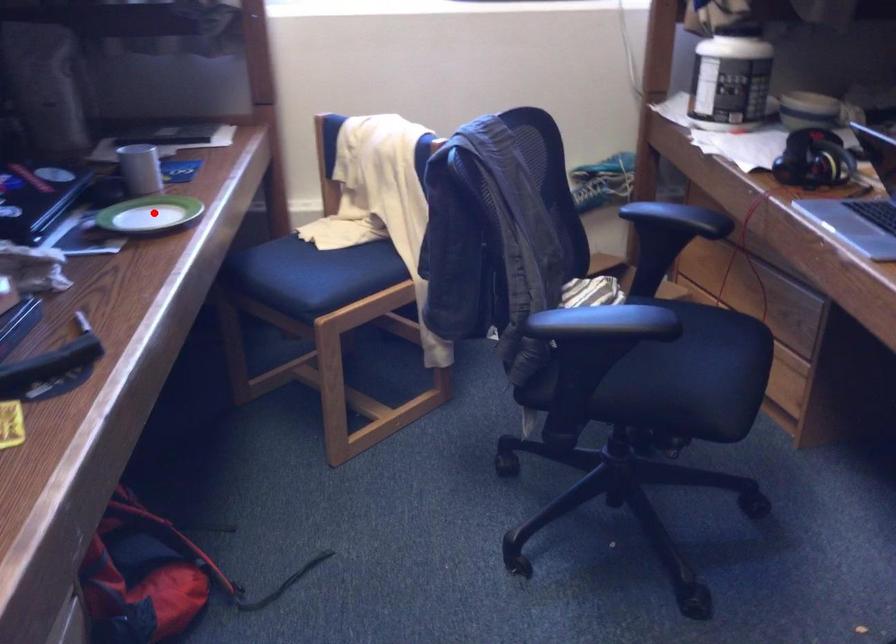
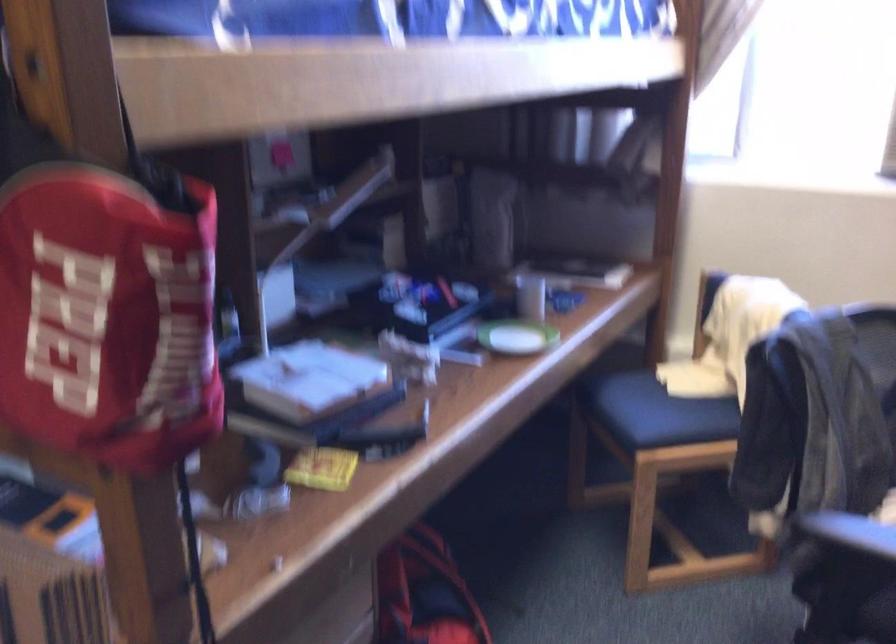
Locate, in the second image, the point that corresponds to the highlighted location in the first image.

(515, 337)